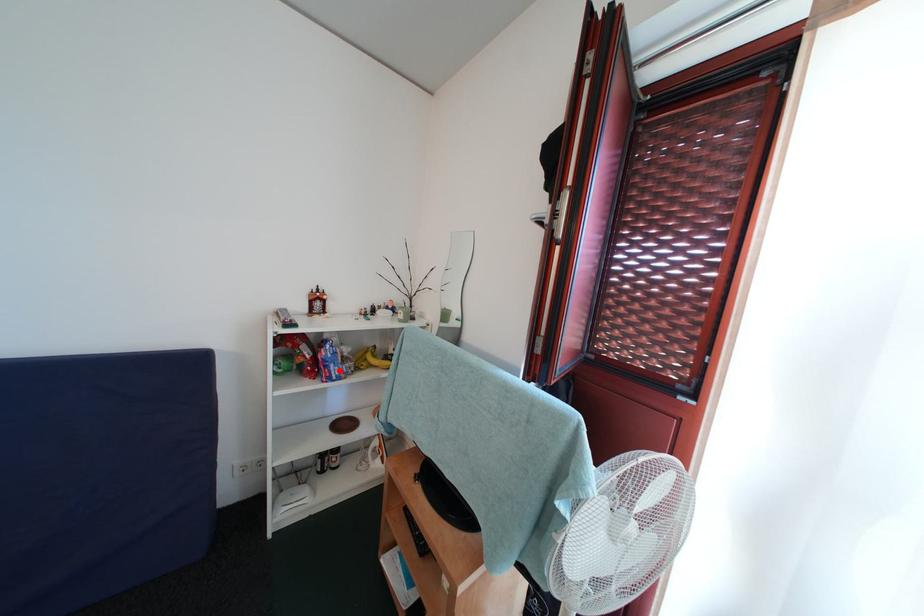
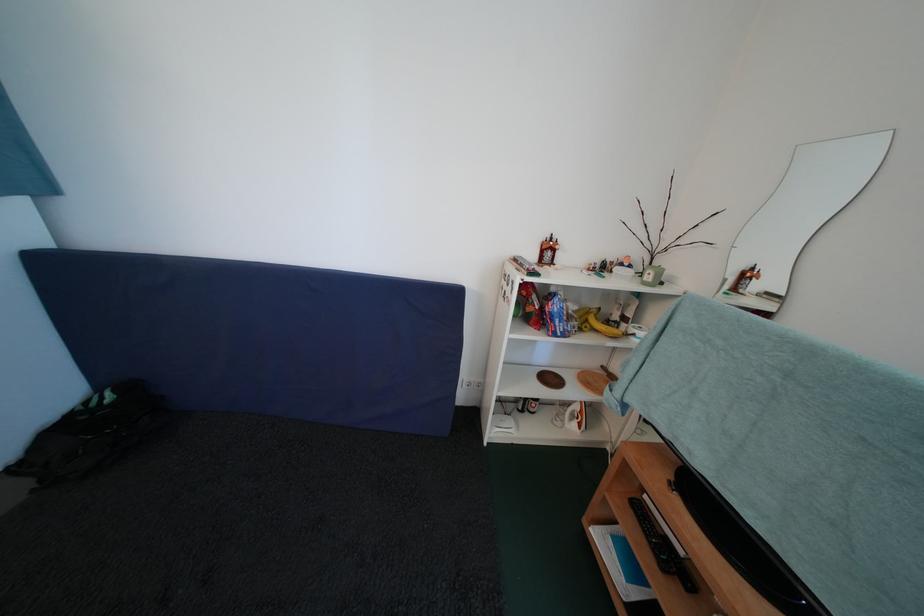
Where in the second image is the point corresponding to the highlighted location from the first image?

(565, 326)